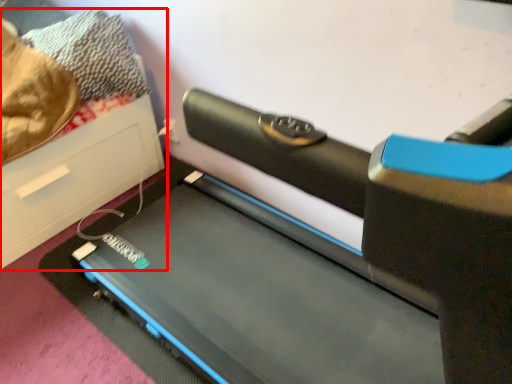
Question: From the image's perspective, what is the correct spatial relationship of furniture (annotated by the red box) in relation to treadmill?

Choices:
 (A) above
 (B) below

Answer: (A)